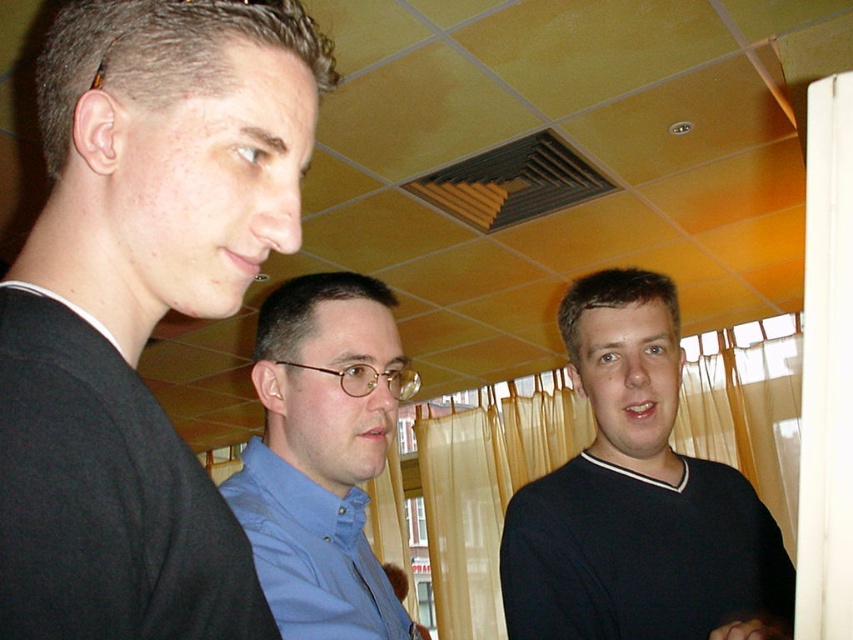
Question: Which point is closer to the camera taking this photo?

Choices:
 (A) (251, 252)
 (B) (347, 573)
 (C) (538, 625)

Answer: (A)

Question: Observing the image, what is the correct spatial positioning of black matte shirt at left in reference to dark blue sweater at center?

Choices:
 (A) left
 (B) right

Answer: (A)

Question: Among these objects, which one is farthest from the camera?

Choices:
 (A) black matte shirt at left
 (B) dark blue sweater at center
 (C) blue shirt at center

Answer: (B)

Question: Does black matte shirt at left have a larger size compared to dark blue sweater at center?

Choices:
 (A) no
 (B) yes

Answer: (A)

Question: Can you confirm if dark blue sweater at center is thinner than blue shirt at center?

Choices:
 (A) no
 (B) yes

Answer: (A)

Question: Which point appears farthest from the camera in this image?

Choices:
 (A) (724, 637)
 (B) (395, 372)

Answer: (A)